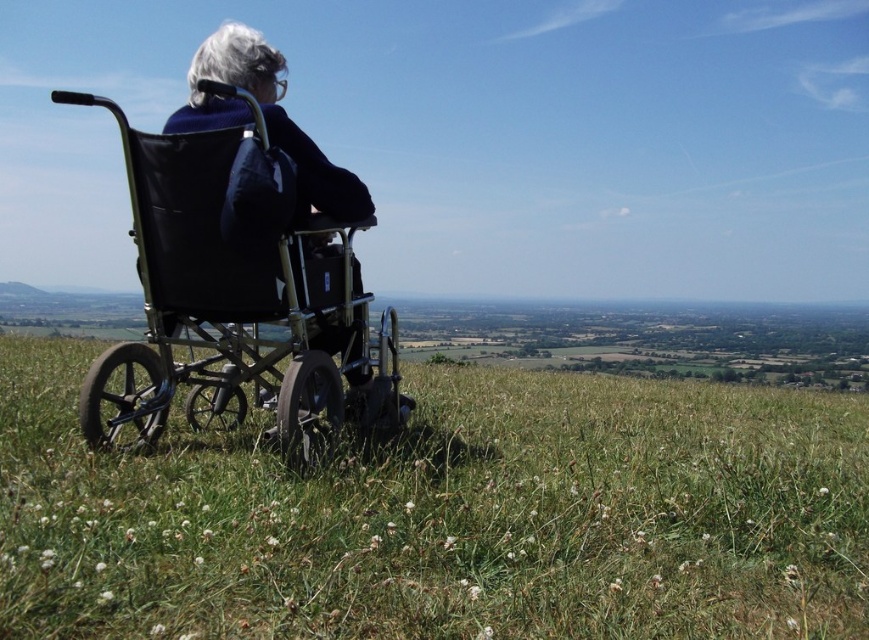
Question: In this image, where is green grassy field at center located relative to metallic black wheelchair at left?

Choices:
 (A) below
 (B) above

Answer: (A)

Question: Does green grassy field at center come in front of metallic black wheelchair at left?

Choices:
 (A) no
 (B) yes

Answer: (B)

Question: Which object appears closest to the camera in this image?

Choices:
 (A) green grassy field at center
 (B) black fabric wheelchair at center

Answer: (A)

Question: Estimate the real-world distances between objects in this image. Which object is closer to the metallic black wheelchair at left?

Choices:
 (A) green grassy field at center
 (B) black fabric wheelchair at center

Answer: (A)

Question: Which object appears farthest from the camera in this image?

Choices:
 (A) green grassy field at center
 (B) black fabric wheelchair at center
 (C) metallic black wheelchair at left

Answer: (B)

Question: Does green grassy field at center appear under black fabric wheelchair at center?

Choices:
 (A) no
 (B) yes

Answer: (B)